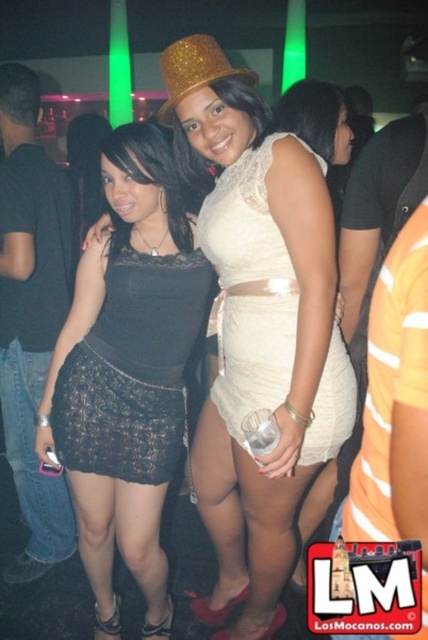
This screenshot has width=428, height=640. Find the location of `lace fabric dress at center`. lace fabric dress at center is located at coordinates (259, 332).

Which is in front, point (232, 499) or point (229, 298)?

Point (229, 298) is more forward.

Locate an element on the screen. lace fabric dress at center is located at coordinates (259, 332).

Who is more forward, (252,154) or (290,120)?

Point (252,154)

Is lace fabric dress at center shorter than matte white dress at center?

No, lace fabric dress at center is not shorter than matte white dress at center.

Which is in front, point (315, 520) or point (303, 580)?

Point (315, 520)

At what (x,y) coordinates should I click in order to perform the action: click on lace fabric dress at center. Please return your answer as a coordinate pair (x, y). The image size is (428, 640). Looking at the image, I should click on (259, 332).

Does lace fabric dress at center have a lesser width compared to black lace skirt at center?

No.

Looking at this image, can you confirm if lace fabric dress at center is positioned to the right of black lace skirt at center?

Yes, lace fabric dress at center is to the right of black lace skirt at center.

Does point (290, 212) come in front of point (100, 428)?

Yes, it is in front of point (100, 428).

Identify the location of lace fabric dress at center. (259, 332).